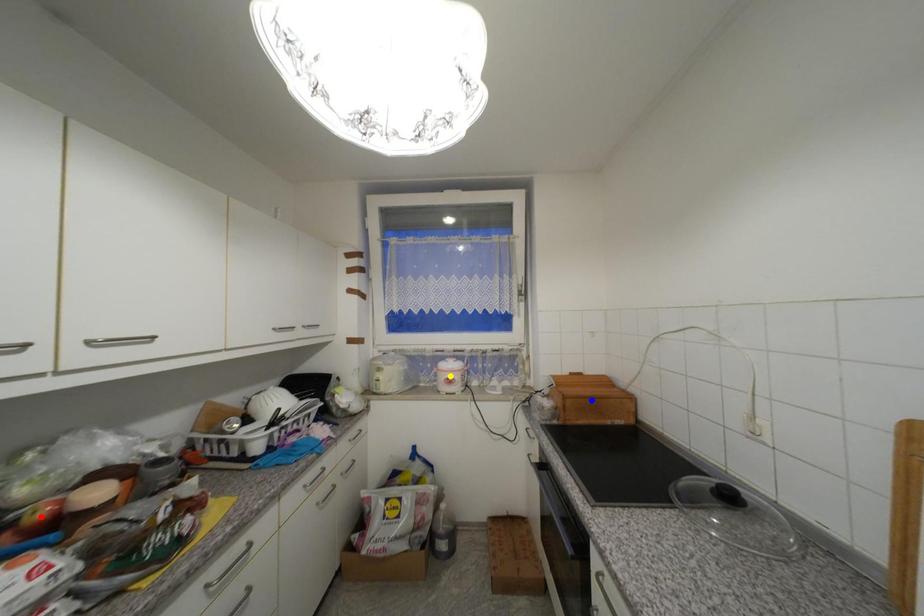
Order these from nearest to farthest:
red point, yellow point, blue point

yellow point → blue point → red point